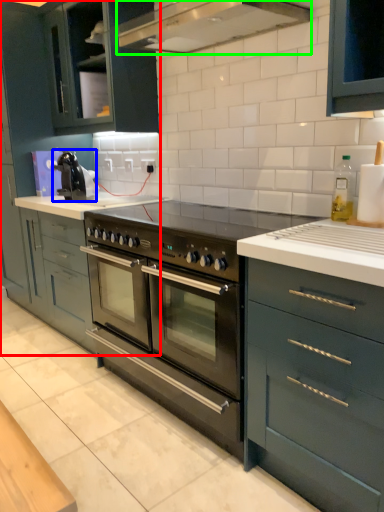
Question: Considering the real-world distances, which object is closest to cabinetry (highlighted by a red box)? kitchen appliance (highlighted by a blue box) or home appliance (highlighted by a green box).

Choices:
 (A) kitchen appliance
 (B) home appliance

Answer: (A)